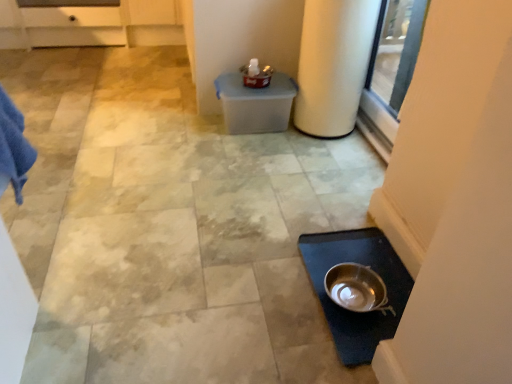
Question: Is white matte cylindrical at right wider than silver metallic mixing bowl at lower right?

Choices:
 (A) yes
 (B) no

Answer: (A)

Question: Is white matte cylindrical at right positioned far away from silver metallic mixing bowl at lower right?

Choices:
 (A) no
 (B) yes

Answer: (A)

Question: Is the depth of white matte cylindrical at right less than that of silver metallic mixing bowl at lower right?

Choices:
 (A) no
 (B) yes

Answer: (A)

Question: Can you confirm if white matte cylindrical at right is bigger than silver metallic mixing bowl at lower right?

Choices:
 (A) no
 (B) yes

Answer: (B)

Question: Is white matte cylindrical at right turned away from silver metallic mixing bowl at lower right?

Choices:
 (A) yes
 (B) no

Answer: (B)

Question: From the image's perspective, is white matte cylindrical at right beneath silver metallic mixing bowl at lower right?

Choices:
 (A) no
 (B) yes

Answer: (A)

Question: Does silver metallic mixing bowl at lower right have a lesser width compared to white matte cylindrical at right?

Choices:
 (A) yes
 (B) no

Answer: (A)

Question: From the image's perspective, is silver metallic mixing bowl at lower right over white matte cylindrical at right?

Choices:
 (A) no
 (B) yes

Answer: (A)

Question: Is silver metallic mixing bowl at lower right with white matte cylindrical at right?

Choices:
 (A) no
 (B) yes

Answer: (A)

Question: Is silver metallic mixing bowl at lower right positioned before white matte cylindrical at right?

Choices:
 (A) no
 (B) yes

Answer: (B)

Question: Is silver metallic mixing bowl at lower right bigger than white matte cylindrical at right?

Choices:
 (A) yes
 (B) no

Answer: (B)

Question: Is white matte cylindrical at right inside silver metallic mixing bowl at lower right?

Choices:
 (A) yes
 (B) no

Answer: (B)

Question: From their relative heights in the image, would you say silver metallic mixing bowl at lower right is taller or shorter than white matte cylindrical at right?

Choices:
 (A) short
 (B) tall

Answer: (A)